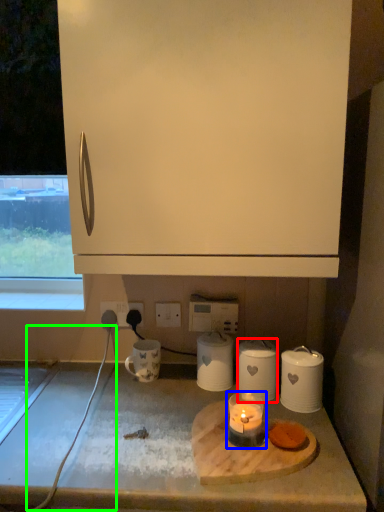
Question: Estimate the real-world distances between objects in this image. Which object is closer to kitchen appliance (highlighted by a red box), candle holder (highlighted by a blue box) or wire (highlighted by a green box)?

Choices:
 (A) candle holder
 (B) wire

Answer: (A)